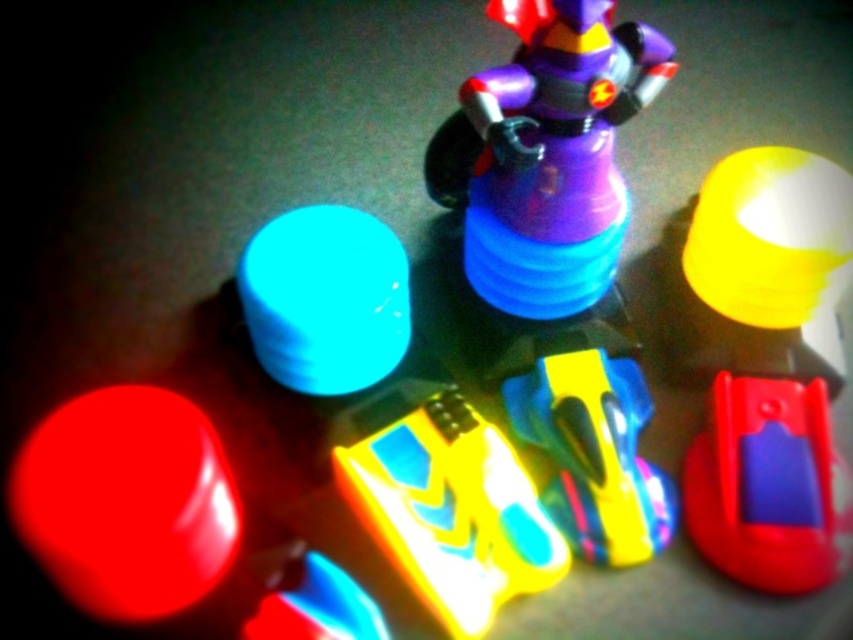
Who is higher up, translucent yellow plastic toy at center or translucent plastic toy at lower center?

Positioned higher is translucent yellow plastic toy at center.

Is translucent yellow plastic toy at center thinner than translucent plastic toy at lower center?

In fact, translucent yellow plastic toy at center might be wider than translucent plastic toy at lower center.

Find the location of a particular element. This screenshot has height=640, width=853. translucent yellow plastic toy at center is located at coordinates (451, 512).

Is rubberized red toy at lower right to the left of translucent plastic toy at lower center from the viewer's perspective?

In fact, rubberized red toy at lower right is to the right of translucent plastic toy at lower center.

Based on the photo, is rubberized red toy at lower right positioned before translucent plastic toy at lower center?

No, rubberized red toy at lower right is behind translucent plastic toy at lower center.

Measure the distance between rubberized red toy at lower right and camera.

A distance of 36.70 inches exists between rubberized red toy at lower right and camera.

I want to click on rubberized red toy at lower right, so click(x=769, y=484).

Does purple matte figure at center lie in front of matte plastic cup at upper left?

Yes, purple matte figure at center is closer to the viewer.

Does purple matte figure at center have a lesser width compared to matte plastic cup at upper left?

No.

Is point (506, 106) positioned behind point (405, 292)?

No, it is not.

At what (x,y) coordinates should I click in order to perform the action: click on purple matte figure at center. Please return your answer as a coordinate pair (x, y). The width and height of the screenshot is (853, 640). Looking at the image, I should click on (547, 154).